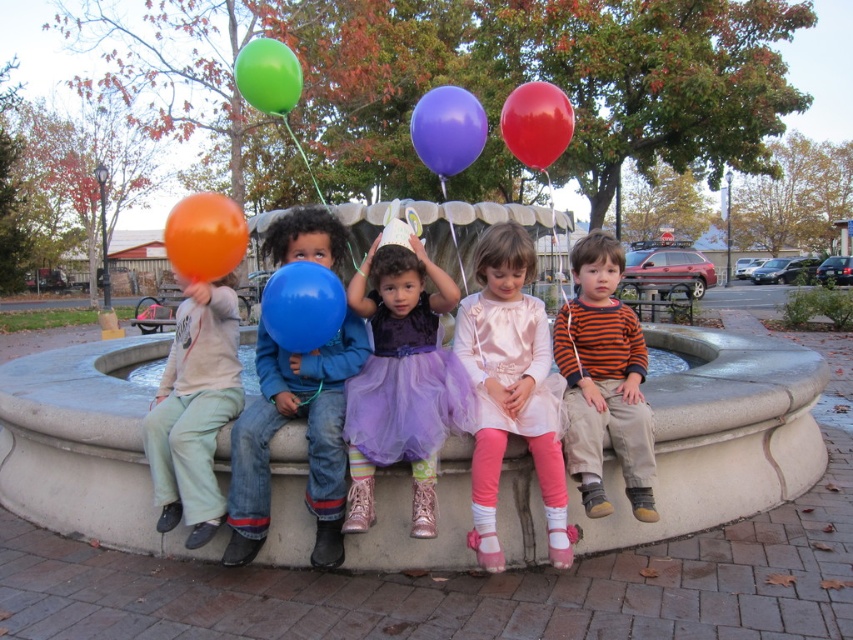
Question: Considering the real-world distances, which object is closest to the purple glossy balloon at center?

Choices:
 (A) orange rubber balloon at left
 (B) light gray cotton shirt at left
 (C) pink satin dress at center
 (D) purple tulle dress at center

Answer: (D)

Question: Which of the following is the closest to the observer?

Choices:
 (A) green rubber balloon at upper center
 (B) blue matte balloon at center
 (C) concrete fountain at center

Answer: (B)

Question: Does light gray cotton shirt at left appear over green rubber balloon at upper center?

Choices:
 (A) yes
 (B) no

Answer: (B)

Question: Does orange rubber balloon at left have a greater width compared to red rubber balloon at center?

Choices:
 (A) yes
 (B) no

Answer: (A)

Question: Is striped cotton shirt at center below orange rubber balloon at left?

Choices:
 (A) no
 (B) yes

Answer: (B)

Question: Which of the following is the closest to the observer?

Choices:
 (A) [x=517, y=102]
 (B) [x=476, y=148]

Answer: (A)